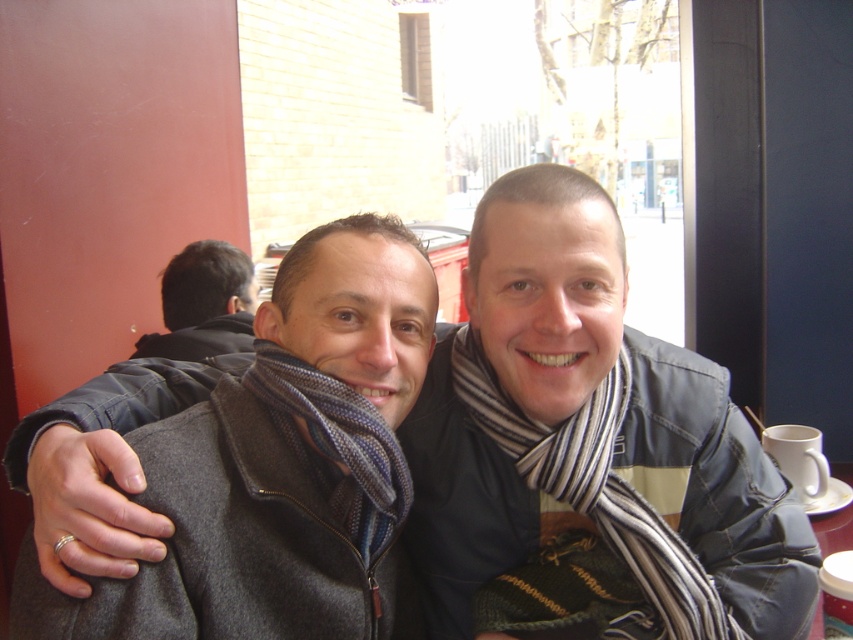
Can you confirm if striped scarf at center is bigger than striped wool scarf at center?

Yes, striped scarf at center is bigger than striped wool scarf at center.

Is striped scarf at center taller than striped wool scarf at center?

Yes, striped scarf at center is taller than striped wool scarf at center.

What do you see at coordinates (585, 417) in the screenshot? The height and width of the screenshot is (640, 853). I see `striped scarf at center` at bounding box center [585, 417].

This screenshot has height=640, width=853. Identify the location of striped scarf at center. (585, 417).

In the scene shown: How far apart are striped scarf at center and striped fabric scarf at center?

striped scarf at center is 3.61 inches away from striped fabric scarf at center.

Is striped scarf at center positioned in front of striped fabric scarf at center?

Yes.

Who is more forward, (x=701, y=374) or (x=497, y=420)?

Point (x=497, y=420) is more forward.

The height and width of the screenshot is (640, 853). Find the location of `striped scarf at center`. striped scarf at center is located at coordinates (585, 417).

Which of these two, striped fabric scarf at center or dark brown hair at upper left, stands taller?

striped fabric scarf at center

What do you see at coordinates (589, 518) in the screenshot? I see `striped fabric scarf at center` at bounding box center [589, 518].

Where is `striped fabric scarf at center`? The height and width of the screenshot is (640, 853). striped fabric scarf at center is located at coordinates (589, 518).